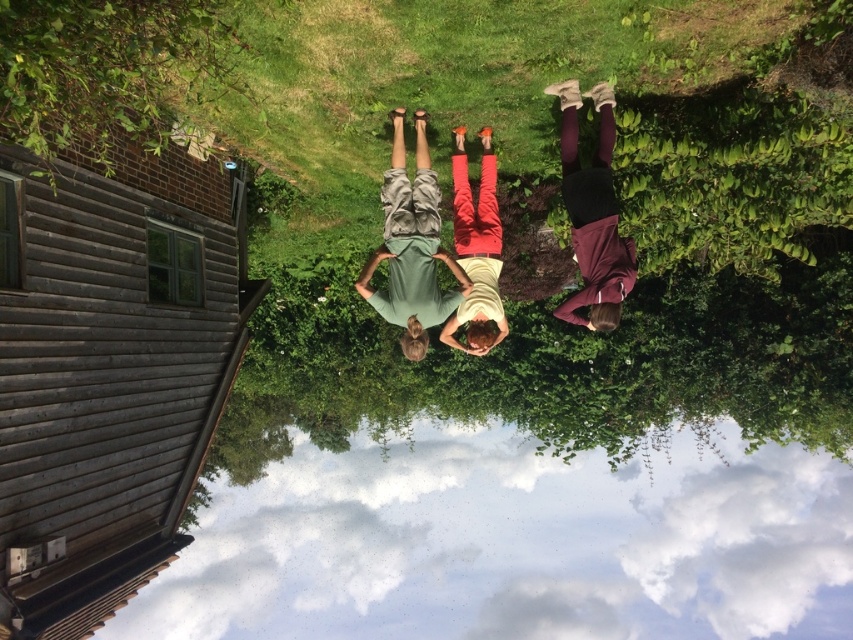
Question: Which object is positioned closest to the maroon fabric pants at center?

Choices:
 (A) transparent glass water at lower center
 (B) matte yellow shirt at center
 (C) green cotton shirt at center

Answer: (B)

Question: Is green cotton shirt at center positioned behind matte yellow shirt at center?

Choices:
 (A) no
 (B) yes

Answer: (A)

Question: Which of the following is the farthest from the observer?

Choices:
 (A) (402, 257)
 (B) (495, 230)
 (C) (579, 298)
 (D) (428, 605)

Answer: (D)

Question: Which point is closer to the camera?

Choices:
 (A) (583, 182)
 (B) (521, 586)
 (C) (490, 148)
 (D) (416, 211)

Answer: (A)

Question: Can you confirm if maroon fabric pants at center is bigger than matte yellow shirt at center?

Choices:
 (A) yes
 (B) no

Answer: (B)

Question: Is the position of green cotton shirt at center less distant than that of maroon fabric pants at center?

Choices:
 (A) yes
 (B) no

Answer: (B)